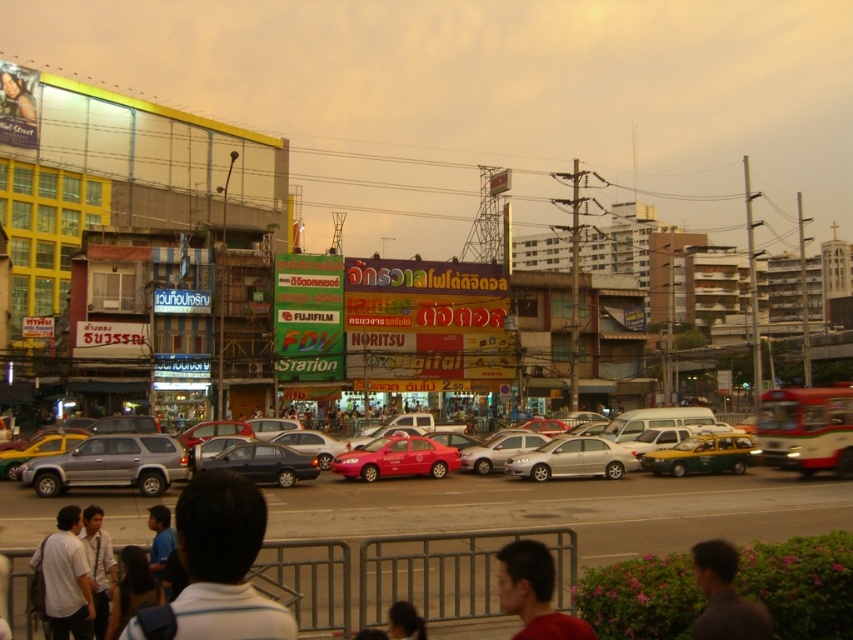
Question: Can you confirm if white fabric shirt at lower center is positioned to the right of matte silver suv at center?

Choices:
 (A) yes
 (B) no

Answer: (B)

Question: Which of the following is the farthest from the observer?

Choices:
 (A) shiny dark gray sedan at center
 (B) white matte shirt at lower left
 (C) matte red taxi at center
 (D) silver metallic suv at center

Answer: (C)

Question: Considering the relative positions of matte red taxi at center and satin silver sedan at center in the image provided, where is matte red taxi at center located with respect to satin silver sedan at center?

Choices:
 (A) above
 (B) below

Answer: (B)

Question: Where is silver metallic suv at center located in relation to matte red shirt at lower center in the image?

Choices:
 (A) below
 (B) above

Answer: (A)

Question: Among these objects, which one is farthest from the camera?

Choices:
 (A) silver metallic suv at center
 (B) white fabric shirt at lower center

Answer: (A)

Question: Which point is closer to the camera?

Choices:
 (A) dark gray shirt at lower right
 (B) shiny dark gray sedan at center
 (C) matte red shirt at lower center

Answer: (C)